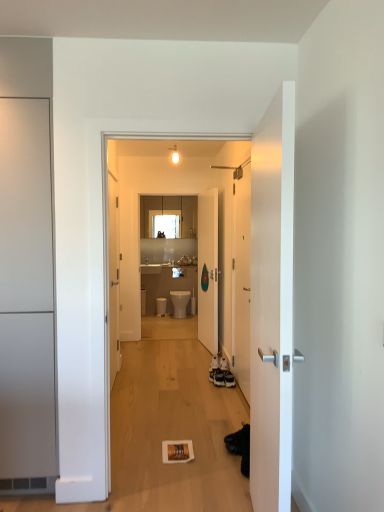
What are the coordinates of `vacant space situated on the left part of white glossy door at center, the 4th door positioned from the left` in the screenshot? It's located at (193, 392).